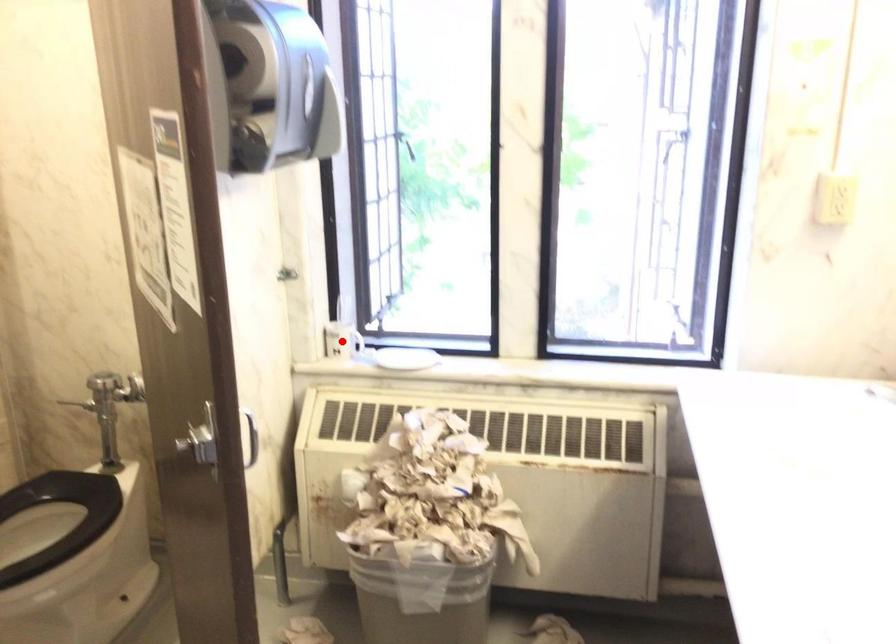
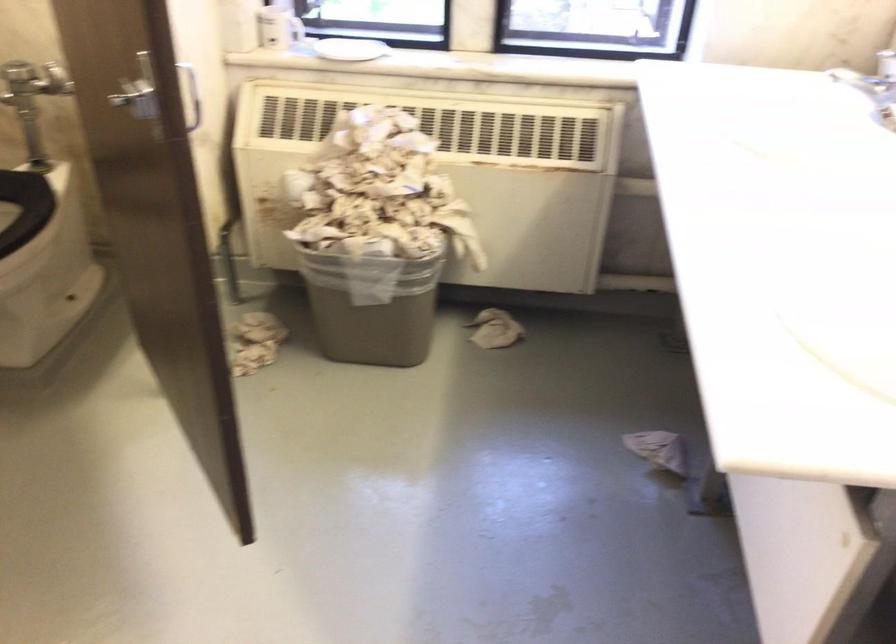
The point at the highlighted location is marked in the first image. Where is the corresponding point in the second image?

(279, 26)